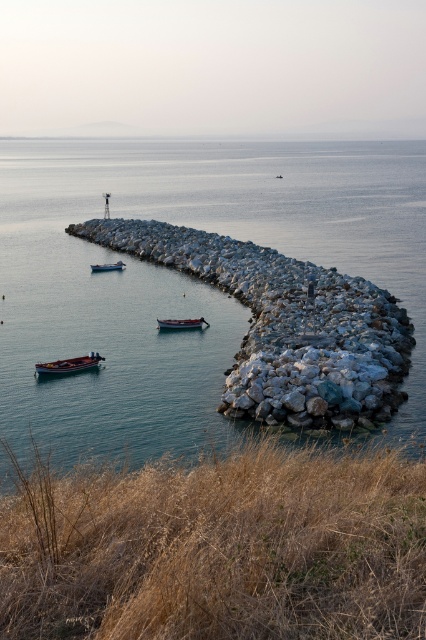
Question: Can you confirm if clear blue water at center is smaller than blue painted wooden boat at left?

Choices:
 (A) no
 (B) yes

Answer: (A)

Question: Is clear blue water at center smaller than wooden boat at lower left?

Choices:
 (A) no
 (B) yes

Answer: (A)

Question: Which point is farther to the camera?

Choices:
 (A) (54, 364)
 (B) (284, 230)
 (C) (173, 328)

Answer: (B)

Question: Can you confirm if wooden boat at lower left is smaller than blue painted wooden boat at left?

Choices:
 (A) yes
 (B) no

Answer: (B)

Question: Which object appears closest to the camera in this image?

Choices:
 (A) wooden boat at center
 (B) wooden boat at lower left

Answer: (B)

Question: Among these objects, which one is farthest from the camera?

Choices:
 (A) clear blue water at center
 (B) blue painted wooden boat at left
 (C) wooden boat at lower left
 (D) wooden boat at center

Answer: (B)